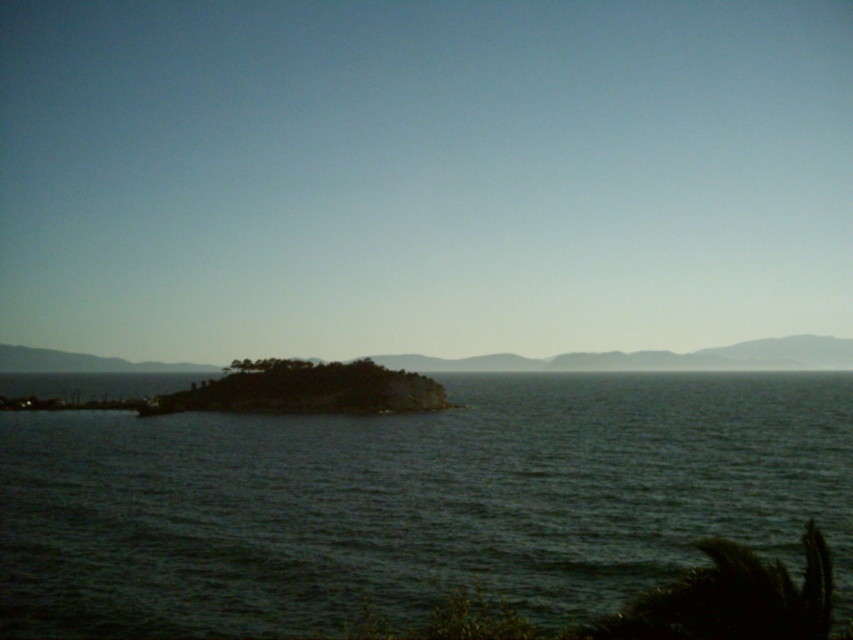
You are a photographer trying to capture the smooth gray horizon at center and the green mossy rock at center in a single frame. Based on their positions, which object will appear larger in the photo?

The smooth gray horizon at center will appear larger in the photo because it is much taller than the green mossy rock at center.

You are a sailor navigating a boat and you see the dark water at center and the smooth gray horizon at center. Which one is closer to your boat if you are positioned at the lower right corner of the image?

The dark water at center is closer to your boat because it is positioned to the left of the smooth gray horizon at center, and since you are at the lower right corner, the dark water at center would be nearer than the horizon.